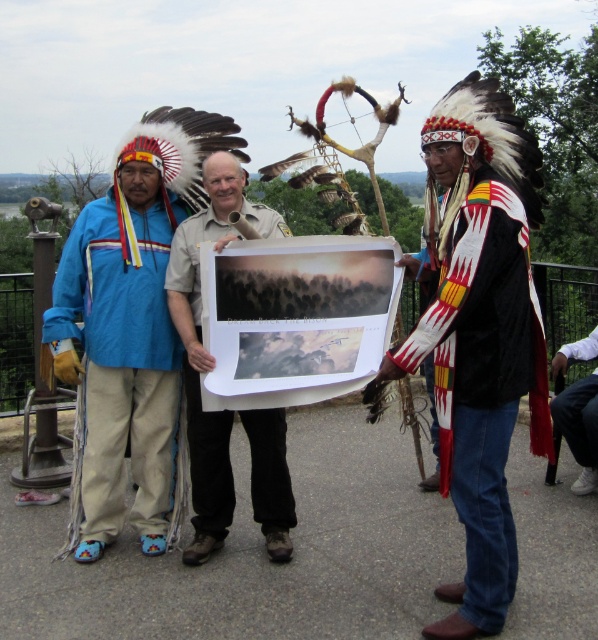
Question: Among these objects, which one is farthest from the camera?

Choices:
 (A) white cotton shirt at lower right
 (B) blue fabric jacket at left

Answer: (A)

Question: Does velvet black jacket at right have a smaller size compared to white cotton shirt at lower right?

Choices:
 (A) no
 (B) yes

Answer: (A)

Question: Does matte khaki shirt at center have a greater width compared to white cotton shirt at lower right?

Choices:
 (A) yes
 (B) no

Answer: (A)

Question: Among these points, which one is farthest from the camera?

Choices:
 (A) (90, 243)
 (B) (582, 472)
 (C) (206, 180)
 (D) (425, 630)

Answer: (B)

Question: Is velvet black jacket at right wider than matte khaki shirt at center?

Choices:
 (A) yes
 (B) no

Answer: (A)

Question: Which of the following is the closest to the observer?

Choices:
 (A) white cotton shirt at lower right
 (B) velvet black jacket at right
 (C) matte khaki shirt at center

Answer: (B)